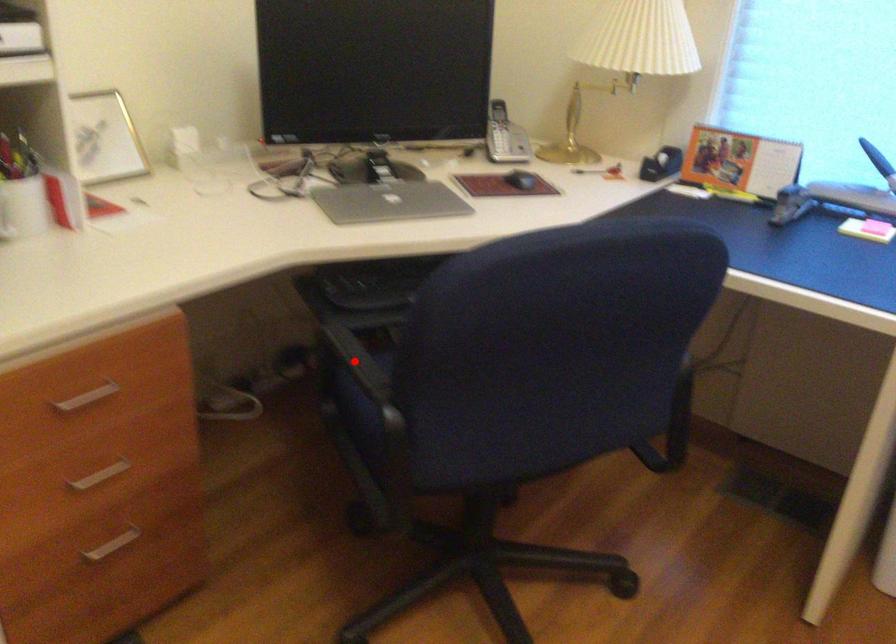
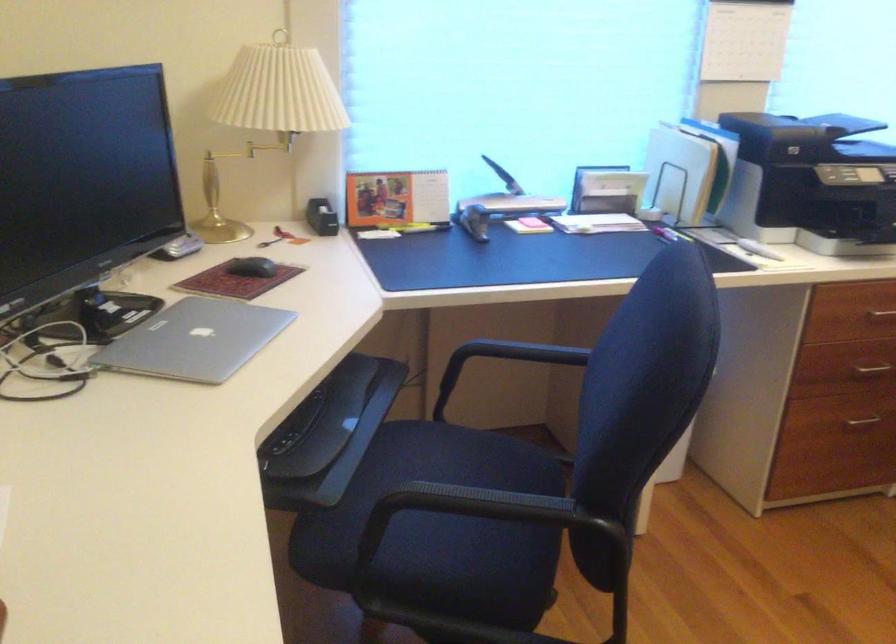
Question: I am providing you with two images of the same scene from different viewpoints. A red point is shown in image1. For the corresponding object point in image2, is it positioned nearer or farther from the camera?

Choices:
 (A) Nearer
 (B) Farther

Answer: (A)